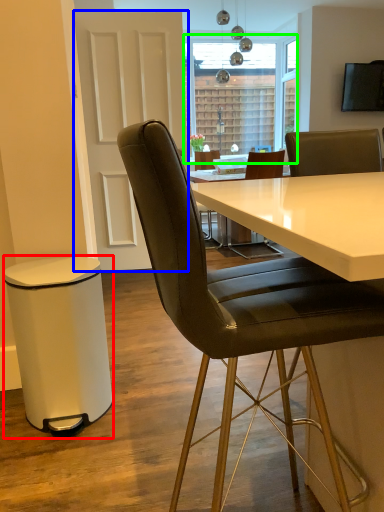
Question: Based on their relative distances, which object is farther from bar stool (highlighted by a red box)? Choose from glass door (highlighted by a blue box) and window screen (highlighted by a green box).

Choices:
 (A) glass door
 (B) window screen

Answer: (B)